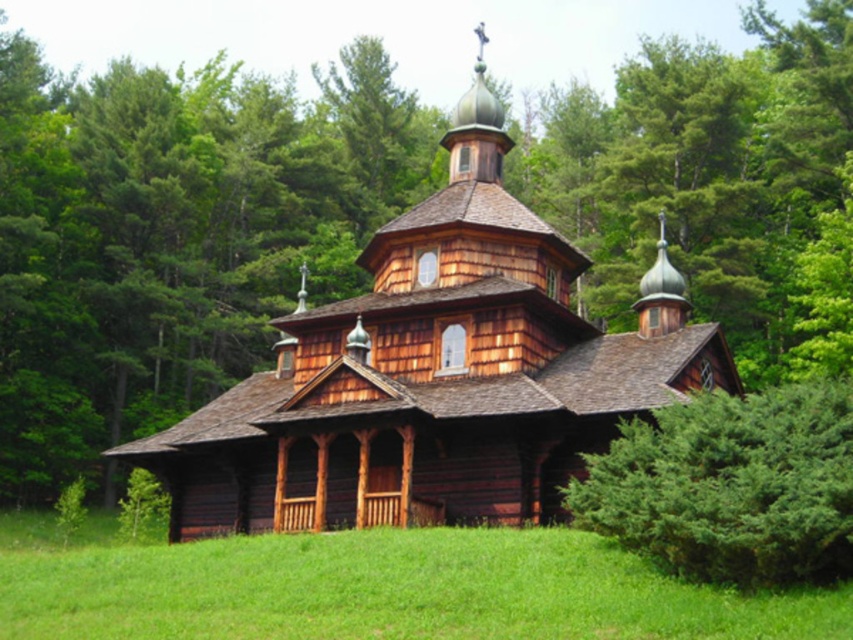
You are standing in the forest looking at the wooden church at center and the green grass at lower center. Which object is closer to you?

The wooden church at center is closer to you than the green grass at lower center because it is positioned further to the viewer.

You are standing at a viewpoint 100 feet away from the wooden church at center. Can you safely walk towards it without needing to move any obstacles?

The distance between you and the wooden church at center is 132.97 feet, so yes, you can safely walk towards it without needing to move any obstacles since the path is clear.

You are standing at the edge of the forest looking at the wooden church at center and the green grass at lower center. Which object is closer to you?

The green grass at lower center is closer to you because it is positioned below the wooden church at center.